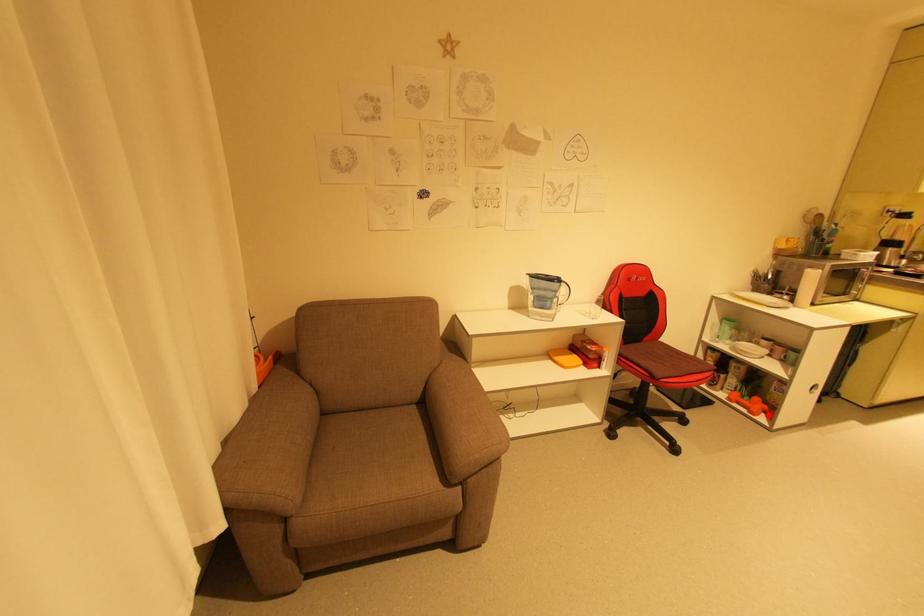
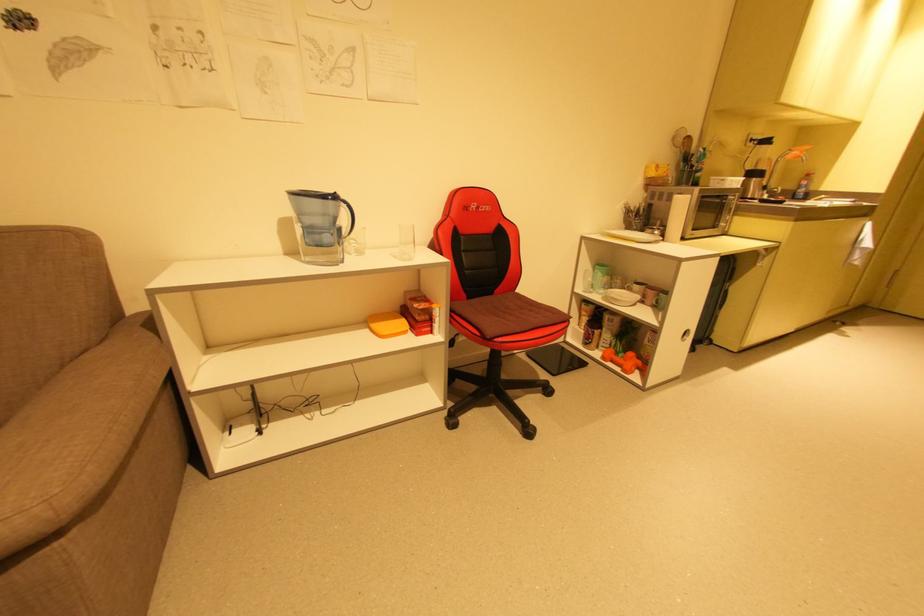
Find the pixel in the second image that matches the highlighted location in the first image.

(641, 371)